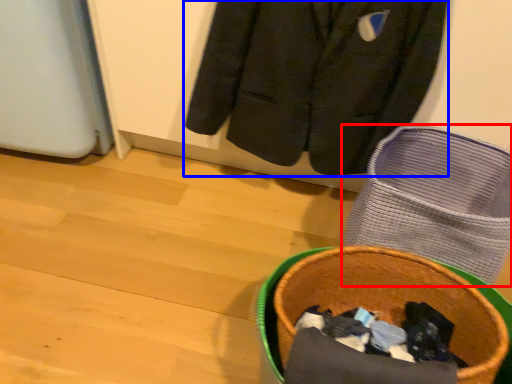
Question: Which point is closer to the camera, footwear (highlighted by a red box) or jacket (highlighted by a blue box)?

Choices:
 (A) footwear
 (B) jacket

Answer: (A)